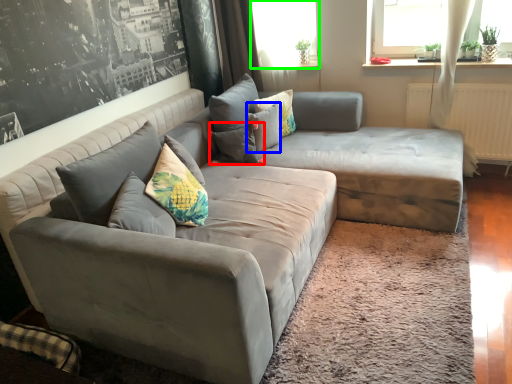
Question: Which object is positioned farthest from pillow (highlighted by a red box)? Select from pillow (highlighted by a blue box) and window screen (highlighted by a green box).

Choices:
 (A) pillow
 (B) window screen

Answer: (B)